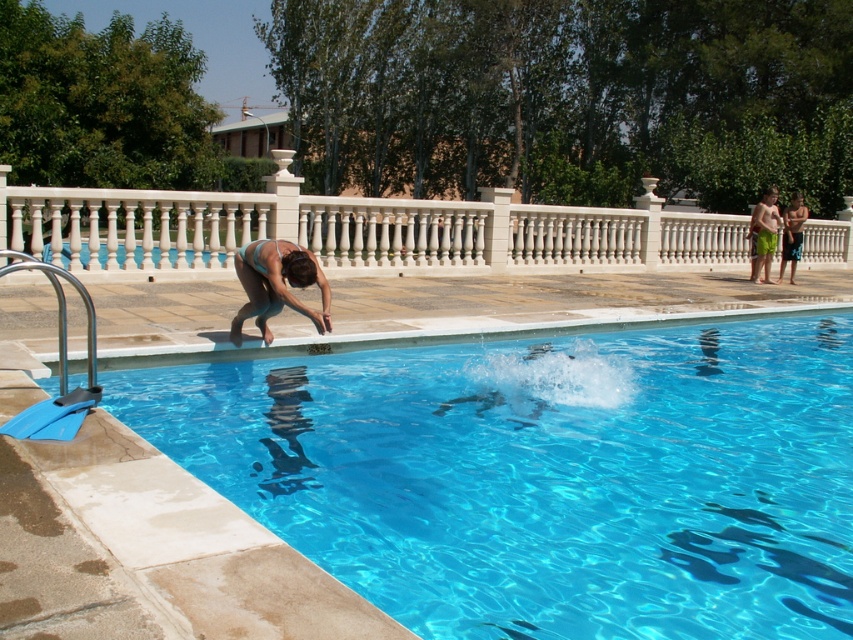
Question: Does white marble railing at upper center have a larger size compared to matte blue swimsuit at lower left?

Choices:
 (A) yes
 (B) no

Answer: (A)

Question: Is transparent blue water at center to the left of green fabric shorts at right from the viewer's perspective?

Choices:
 (A) no
 (B) yes

Answer: (B)

Question: Which point is farther to the camera?

Choices:
 (A) (798, 253)
 (B) (256, 268)
 (C) (126, 621)

Answer: (A)

Question: Can you confirm if matte blue swimsuit at lower left is bigger than blue shorts at right?

Choices:
 (A) no
 (B) yes

Answer: (A)

Question: Which point appears farthest from the camera in this image?

Choices:
 (A) (755, 268)
 (B) (799, 202)
 (C) (247, 266)

Answer: (A)

Question: Based on their relative distances, which object is nearer to the white marble railing at upper center?

Choices:
 (A) green fabric shorts at right
 (B) blue shorts at right

Answer: (A)